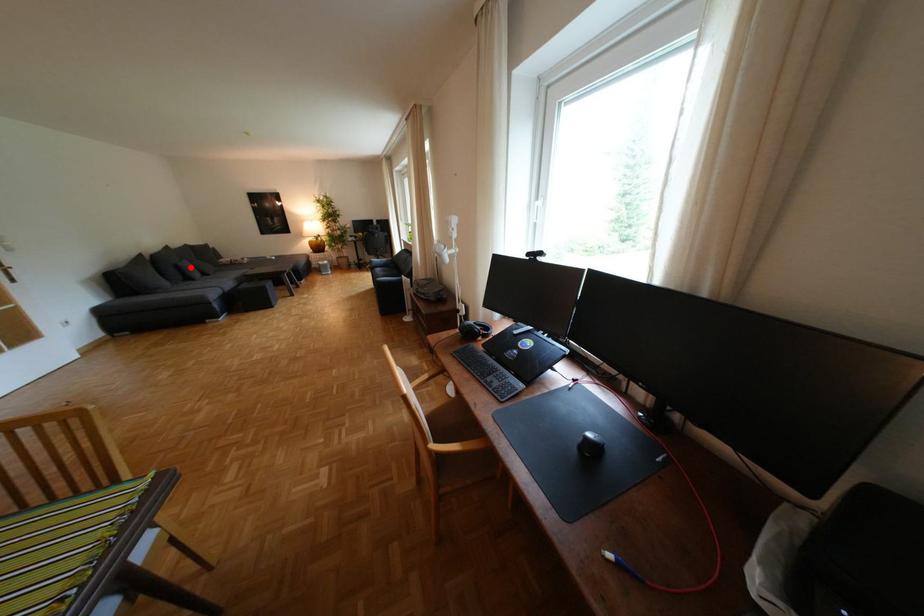
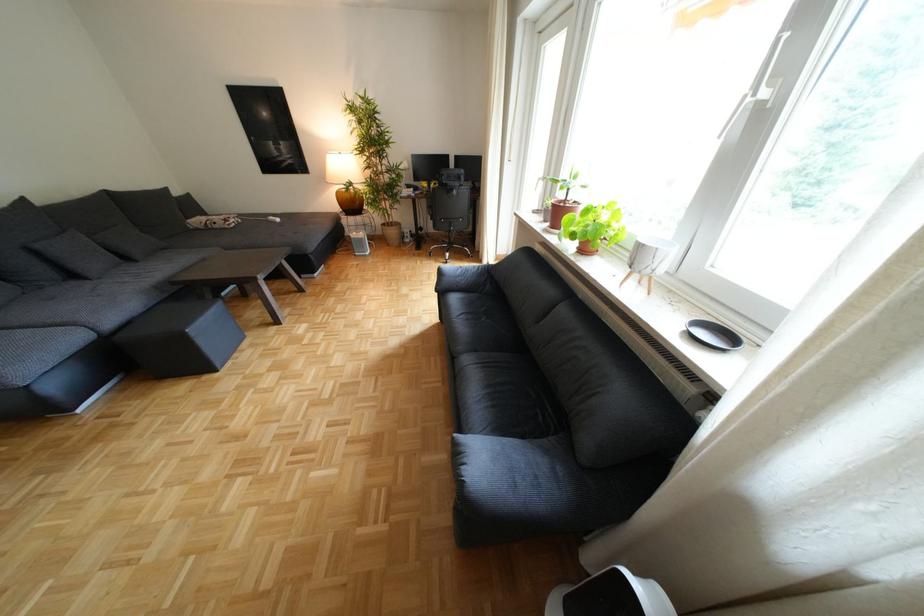
Question: I am providing you with two images of the same scene from different viewpoints. Image1 has a red point marked. In image2, the corresponding 3D location appears at what relative position? Reply with the corresponding letter.

Choices:
 (A) Closer
 (B) Farther

Answer: (B)